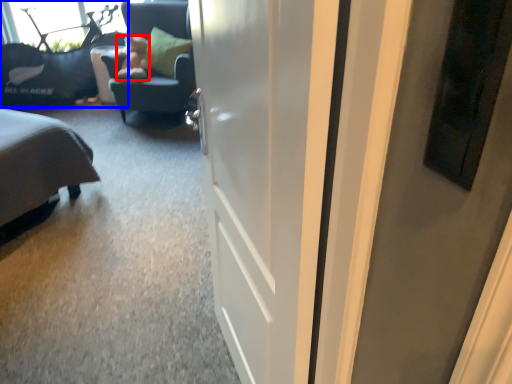
Question: Which point is closer to the camera, teddy (highlighted by a red box) or furniture (highlighted by a blue box)?

Choices:
 (A) teddy
 (B) furniture

Answer: (A)